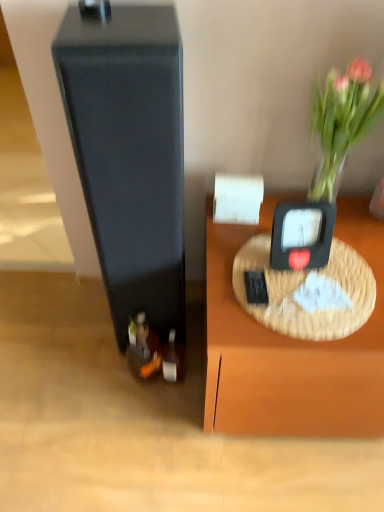
Where is `free space in front of shiny silver wine bottle at lower center, which is the second wine bottle in left-to-right order`? free space in front of shiny silver wine bottle at lower center, which is the second wine bottle in left-to-right order is located at coordinates (177, 426).